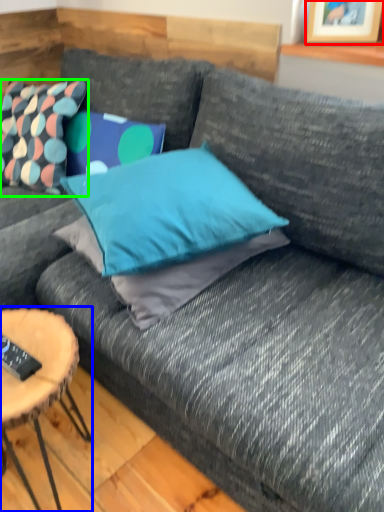
Question: Based on their relative distances, which object is nearer to picture frame (highlighted by a red box)? Choose from coffee table (highlighted by a blue box) and pillow (highlighted by a green box).

Choices:
 (A) coffee table
 (B) pillow

Answer: (B)